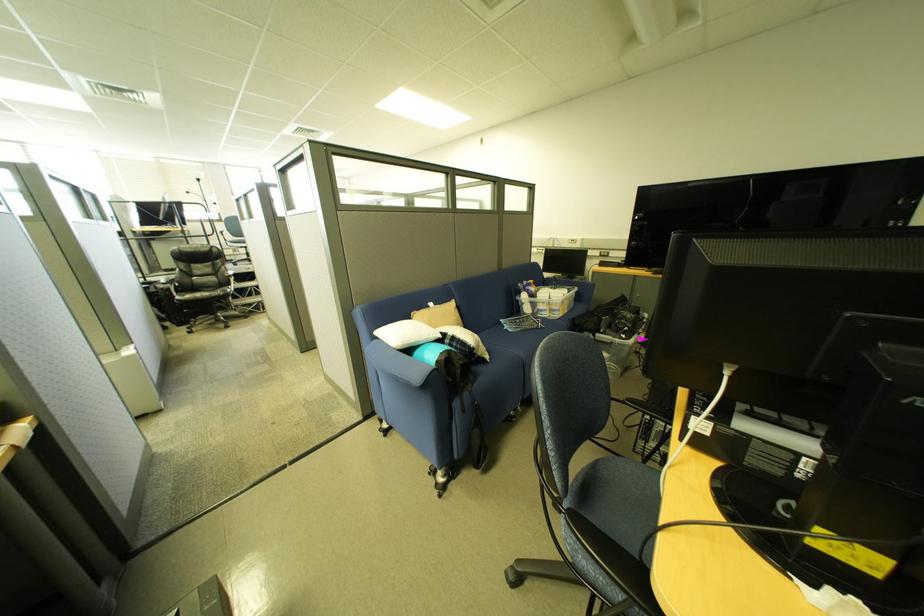
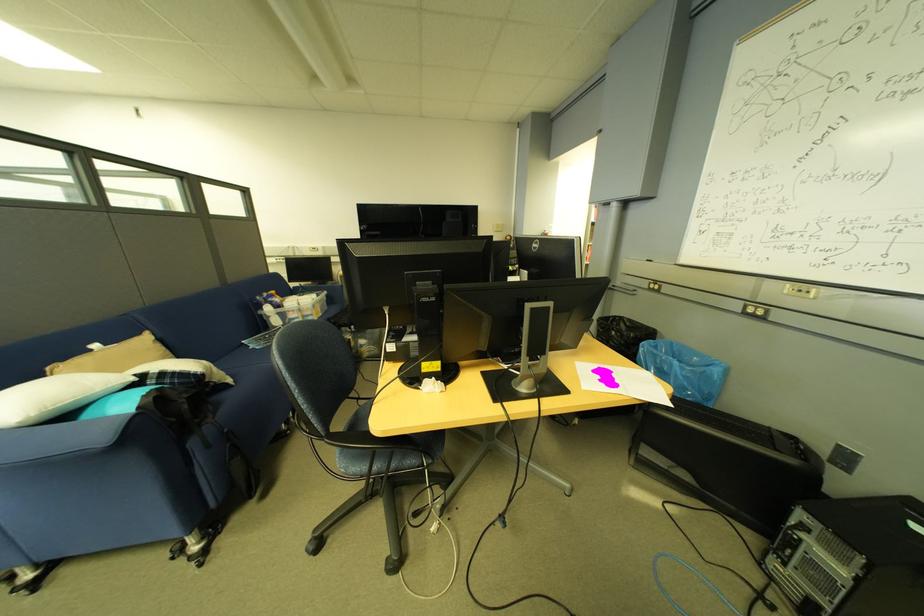
Question: The camera is either moving clockwise (left) or counter-clockwise (right) around the object. The first image is from the beginning of the video and the second image is from the end. Is the camera moving left or right when shooting the video?

Choices:
 (A) Left
 (B) Right

Answer: (A)